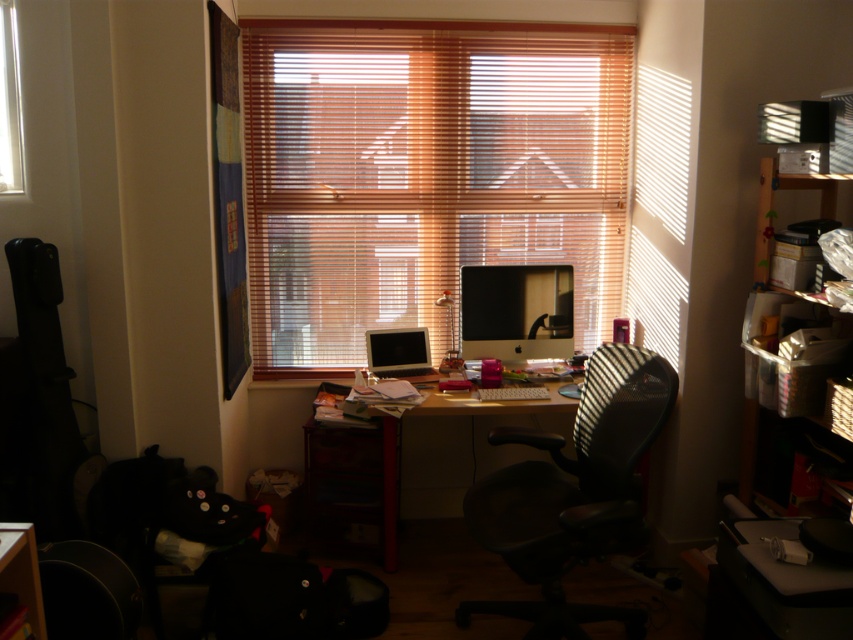
Does point (361, 170) lie behind point (12, 36)?

Yes.

Which is behind, point (616, 125) or point (20, 160)?

Positioned behind is point (616, 125).

The width and height of the screenshot is (853, 640). What are the coordinates of `wooden blinds at center` in the screenshot? It's located at (425, 173).

Locate an element on the screen. The height and width of the screenshot is (640, 853). wooden blinds at center is located at coordinates (425, 173).

How much distance is there between transparent glass window at upper left and matte black monitor at center?

A distance of 5.28 feet exists between transparent glass window at upper left and matte black monitor at center.

From the picture: Who is more forward, (7,147) or (378,353)?

Point (7,147) is in front.

The image size is (853, 640). Identify the location of transparent glass window at upper left. (9, 104).

Between black mesh office chair at center and matte black monitor at center, which one is positioned lower?

black mesh office chair at center is below.

This screenshot has width=853, height=640. I want to click on black mesh office chair at center, so click(x=573, y=492).

Is point (577, 515) farther from viewer compared to point (366, 348)?

No, it is in front of (366, 348).

In order to click on black mesh office chair at center in this screenshot , I will do `click(573, 492)`.